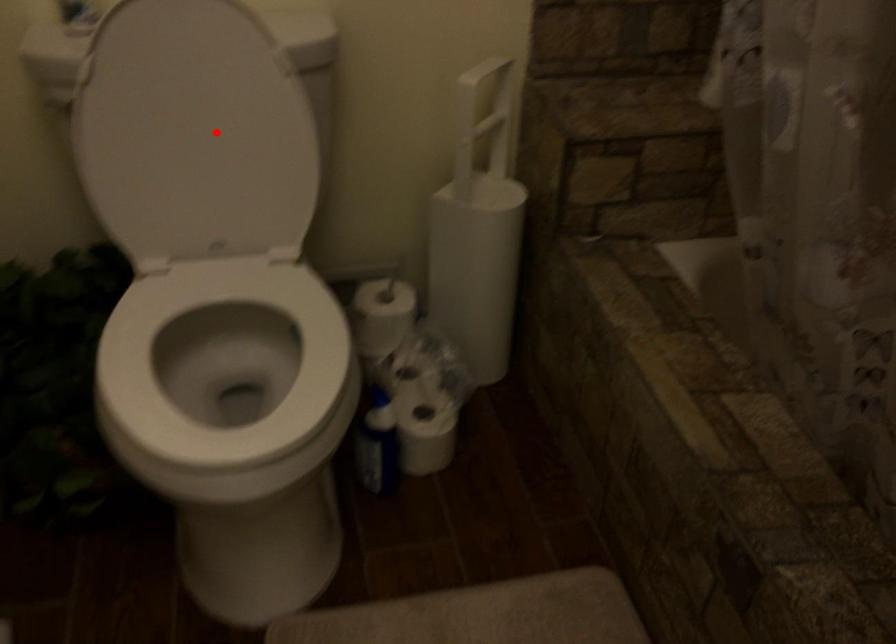
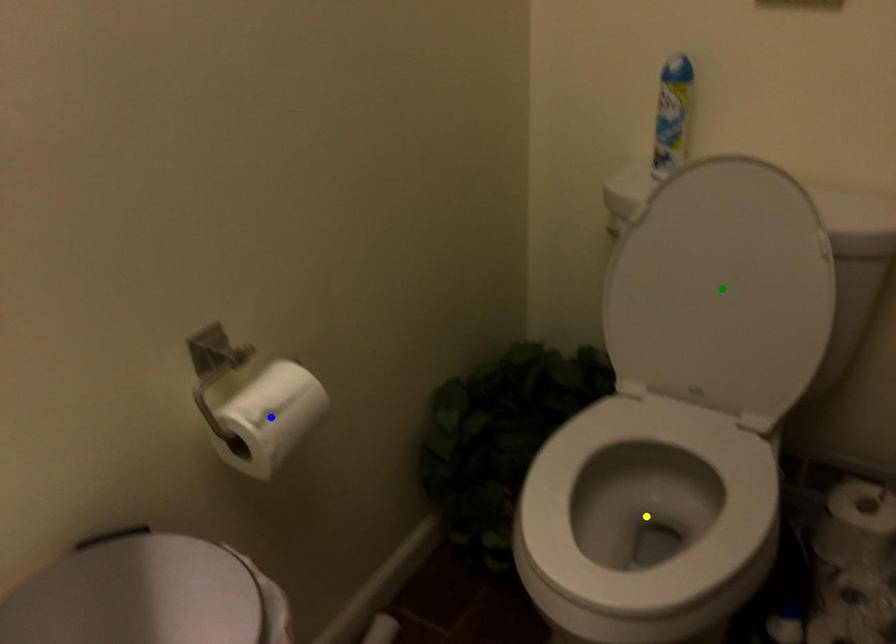
Question: I am providing you with two images of the same scene from different viewpoints. A red point is marked on the first image. You are given multiple points on the second image. Can you choose the point in image 2 that corresponds to the point in image 1?

Choices:
 (A) green point
 (B) blue point
 (C) yellow point

Answer: (A)